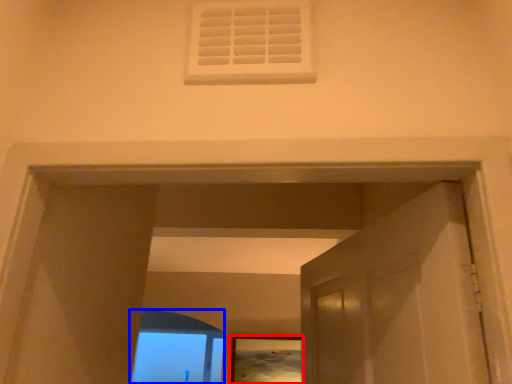
Question: Which object appears closest to the camera in this image, picture frame (highlighted by a red box) or window frame (highlighted by a blue box)?

Choices:
 (A) picture frame
 (B) window frame

Answer: (A)